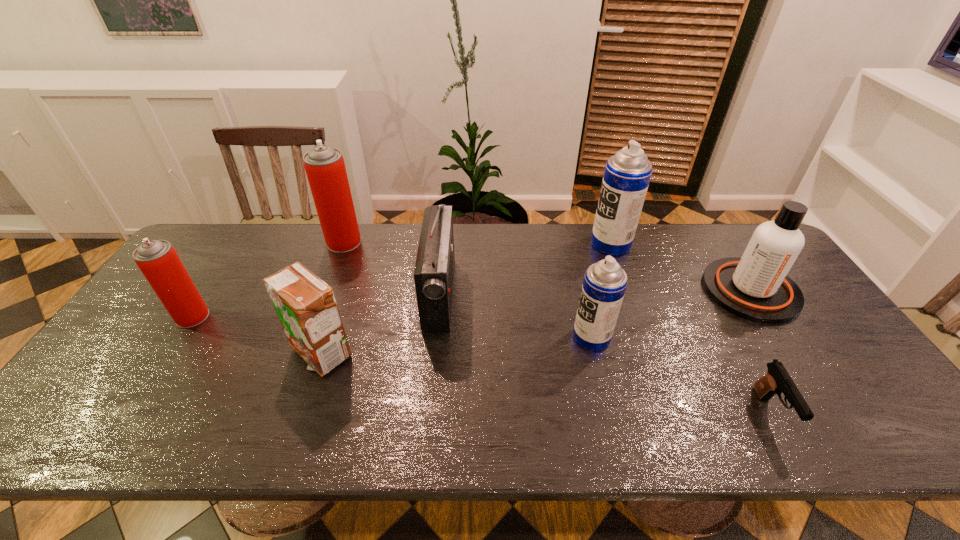
Where is `unoccupied area between the pistol and the cleansing agent`? unoccupied area between the pistol and the cleansing agent is located at coordinates (760, 352).

Find the location of a particular element. free space that is in between the carton and the left red aerosol can is located at coordinates (256, 335).

What are the coordinates of `object that is the sixth closest one to the left blue aerosol can` in the screenshot? It's located at (324, 165).

This screenshot has width=960, height=540. In order to click on object that can be found as the fifth closest to the fifth object from right to left in this screenshot , I will do `click(157, 259)`.

Identify which aerosol can is the second closest to the white cleansing agent. Please provide its 2D coordinates. Your answer should be formatted as a tuple, i.e. [(x, y)], where the tuple contains the x and y coordinates of a point satisfying the conditions above.

[(605, 282)]

Where is `aerosol can that is the second closest one to the carton`? This screenshot has width=960, height=540. aerosol can that is the second closest one to the carton is located at coordinates (324, 165).

Find the location of `free space that satisfies the following two spatial constraints: 1. on the back side of the white cleansing agent; 2. on the left side of the smaller red aerosol can`. free space that satisfies the following two spatial constraints: 1. on the back side of the white cleansing agent; 2. on the left side of the smaller red aerosol can is located at coordinates (210, 291).

Locate an element on the screen. free space that satisfies the following two spatial constraints: 1. on the front-facing side of the radio receiver; 2. on the straw side of the carton is located at coordinates (434, 353).

Find the location of a particular element. vacant region that satisfies the following two spatial constraints: 1. on the label side of the second aerosol can from right to left; 2. on the straw side of the carton is located at coordinates (595, 353).